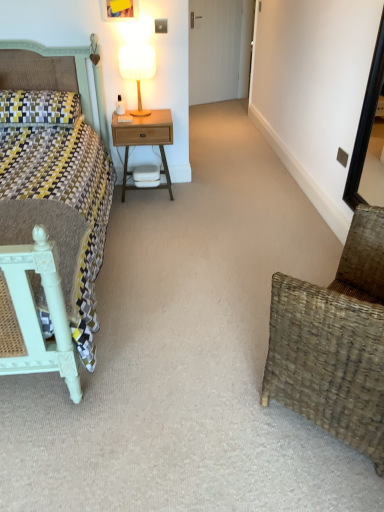
This screenshot has height=512, width=384. What are the coordinates of `vacant area on top of woodenmaterial/texturenightstand at center (from a real-world perspective)` in the screenshot? It's located at (148, 115).